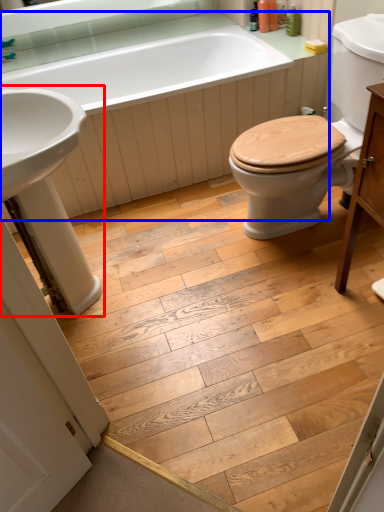
Question: Which of the following is the farthest to the observer, sink (highlighted by a red box) or bath (highlighted by a blue box)?

Choices:
 (A) sink
 (B) bath

Answer: (B)